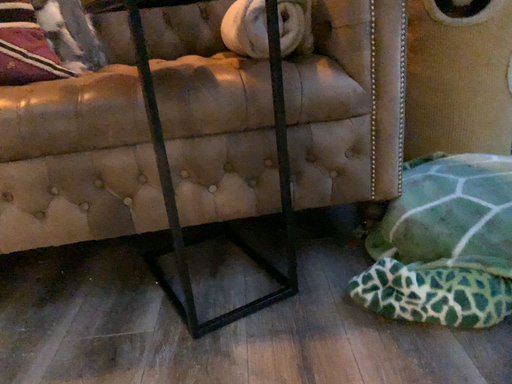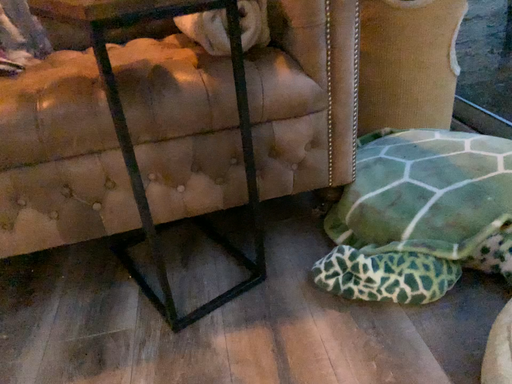
Question: How did the camera likely rotate when shooting the video?

Choices:
 (A) rotated downward
 (B) rotated upward

Answer: (A)